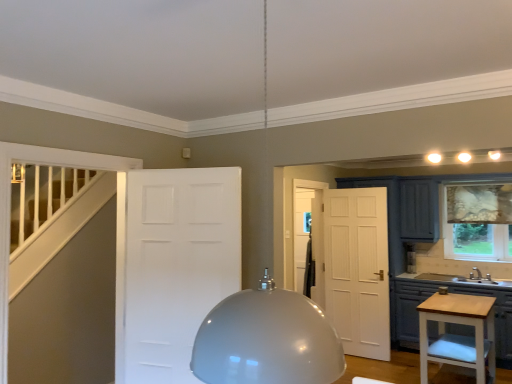
Question: Is matte gray cabinets at lower right facing away from light wood vanity at lower right?

Choices:
 (A) no
 (B) yes

Answer: (A)

Question: From a real-world perspective, is matte gray cabinets at lower right on top of light wood vanity at lower right?

Choices:
 (A) no
 (B) yes

Answer: (A)

Question: Does matte gray cabinets at lower right have a lesser width compared to light wood vanity at lower right?

Choices:
 (A) yes
 (B) no

Answer: (B)

Question: Can light wood vanity at lower right be found inside matte gray cabinets at lower right?

Choices:
 (A) no
 (B) yes

Answer: (A)

Question: From the image's perspective, does matte gray cabinets at lower right appear lower than light wood vanity at lower right?

Choices:
 (A) yes
 (B) no

Answer: (A)

Question: Is light wood vanity at lower right taller or shorter than patterned fabric curtain at right?

Choices:
 (A) short
 (B) tall

Answer: (A)

Question: Is point (463, 359) closer or farther from the camera than point (464, 196)?

Choices:
 (A) farther
 (B) closer

Answer: (B)

Question: Is light wood vanity at lower right situated inside patterned fabric curtain at right or outside?

Choices:
 (A) inside
 (B) outside

Answer: (B)

Question: From the image's perspective, is light wood vanity at lower right above or below patterned fabric curtain at right?

Choices:
 (A) above
 (B) below

Answer: (B)

Question: From the image's perspective, is white matte door at center located above or below light wood vanity at lower right?

Choices:
 (A) below
 (B) above

Answer: (B)

Question: Is white matte door at center situated inside light wood vanity at lower right or outside?

Choices:
 (A) inside
 (B) outside

Answer: (B)

Question: Is white matte door at center wider or thinner than light wood vanity at lower right?

Choices:
 (A) wide
 (B) thin

Answer: (B)

Question: Considering the positions of white matte door at center and light wood vanity at lower right in the image, is white matte door at center taller or shorter than light wood vanity at lower right?

Choices:
 (A) short
 (B) tall

Answer: (B)

Question: Is white matte door at center taller or shorter than matte gray cabinets at lower right?

Choices:
 (A) short
 (B) tall

Answer: (B)

Question: Considering the positions of point (162, 367) and point (396, 322), is point (162, 367) closer or farther from the camera than point (396, 322)?

Choices:
 (A) closer
 (B) farther

Answer: (A)